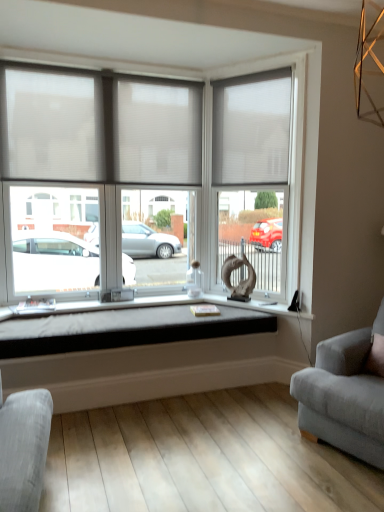
This screenshot has height=512, width=384. In order to click on free space above black fabric cushion at center (from a real-world perspective) in this screenshot , I will do `click(108, 315)`.